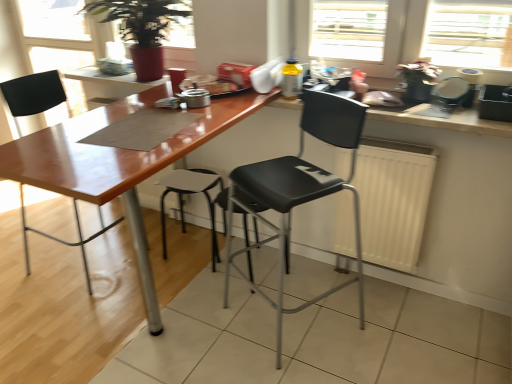
In order to click on free area in between matte wood table at center, the 2th table viewed from the top, and matte black chair at left, which is the second chair from right to left in this screenshot , I will do `click(92, 296)`.